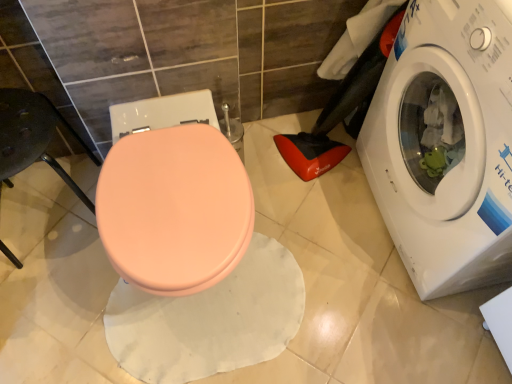
Question: In terms of height, does matte pink seat at left look taller or shorter compared to white glossy washing machine at right?

Choices:
 (A) tall
 (B) short

Answer: (B)

Question: Considering the positions of point pyautogui.click(x=8, y=178) and point pyautogui.click(x=471, y=23), is point pyautogui.click(x=8, y=178) closer or farther from the camera than point pyautogui.click(x=471, y=23)?

Choices:
 (A) closer
 (B) farther

Answer: (B)

Question: Considering the real-world distances, which object is closest to the matte pink bidet at center?

Choices:
 (A) white glossy washing machine at right
 (B) matte pink seat at left

Answer: (B)

Question: Which of these objects is positioned closest to the white glossy washing machine at right?

Choices:
 (A) matte pink seat at left
 (B) matte pink bidet at center

Answer: (B)